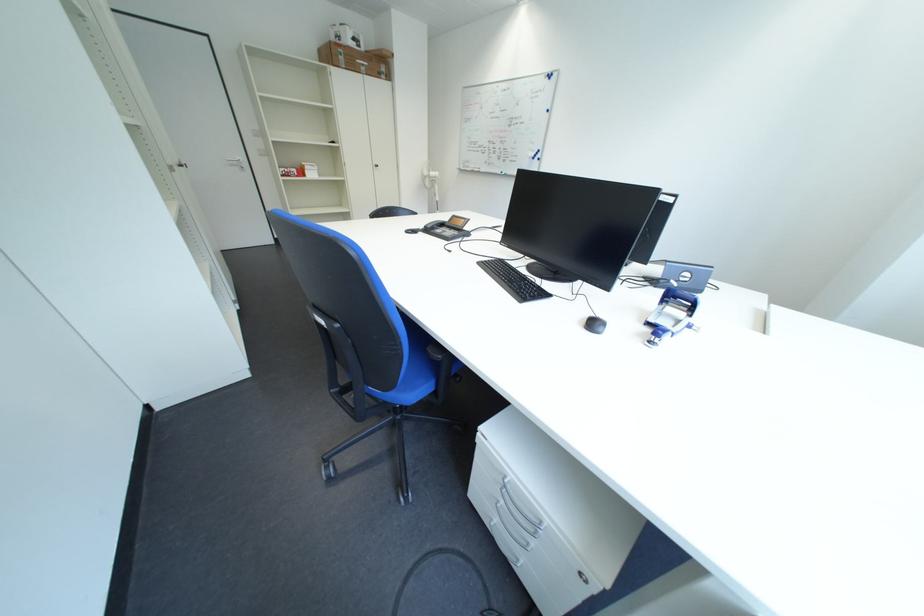
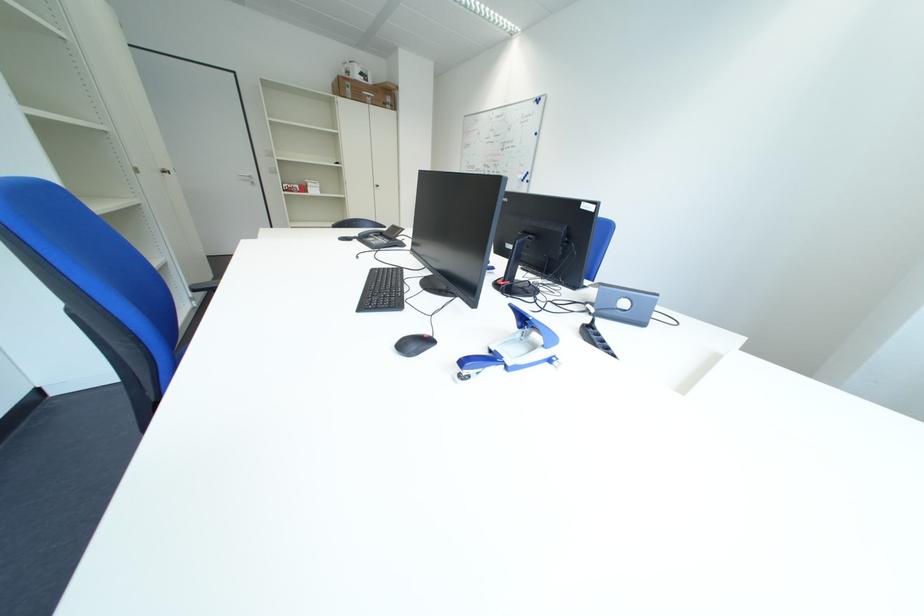
Where in the second image is the point corresponding to (x=432, y=236) from the first image?

(368, 244)